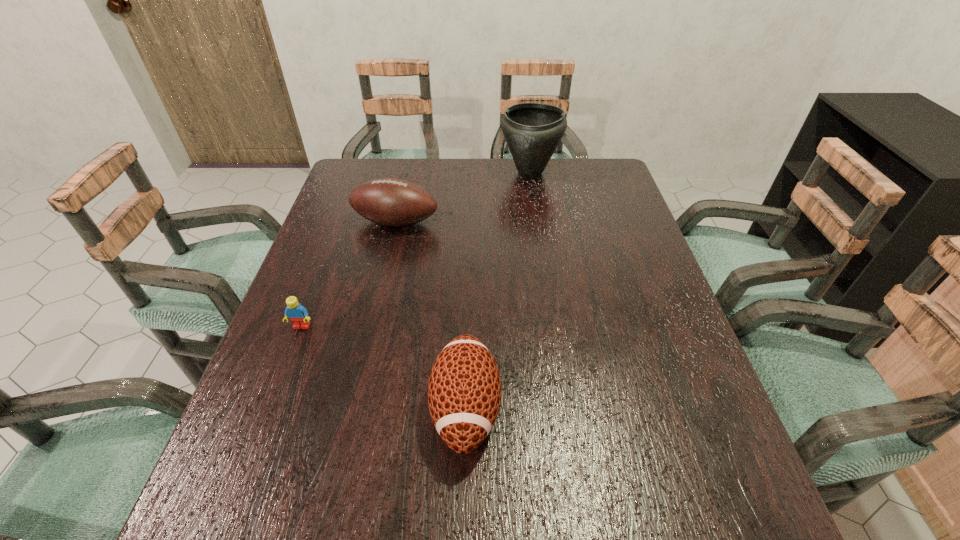
Image resolution: width=960 pixels, height=540 pixels. Identify the location of free area in between the second farthest object and the Lego. (348, 274).

Identify the location of object that is the third closest one to the Lego. This screenshot has width=960, height=540. (532, 131).

Where is `object that is the second closest to the shortest object`? This screenshot has height=540, width=960. object that is the second closest to the shortest object is located at coordinates (392, 202).

You are a GUI agent. You are given a task and a screenshot of the screen. Output one action in this format:
    pyautogui.click(x=<x>, y=<y>)
    Task: Click on the free space that satisfies the following two spatial constraints: 1. on the back side of the third object from right to left; 2. on the left side of the tallest object
    
    Given the screenshot: What is the action you would take?
    pyautogui.click(x=407, y=173)

The height and width of the screenshot is (540, 960). Identify the location of free spot that satisfies the following two spatial constraints: 1. on the back side of the urn; 2. on the right side of the left football. (407, 173).

Locate an element on the screen. The width and height of the screenshot is (960, 540). free space that satisfies the following two spatial constraints: 1. on the face of the nearest object; 2. on the right side of the shortest object is located at coordinates (271, 408).